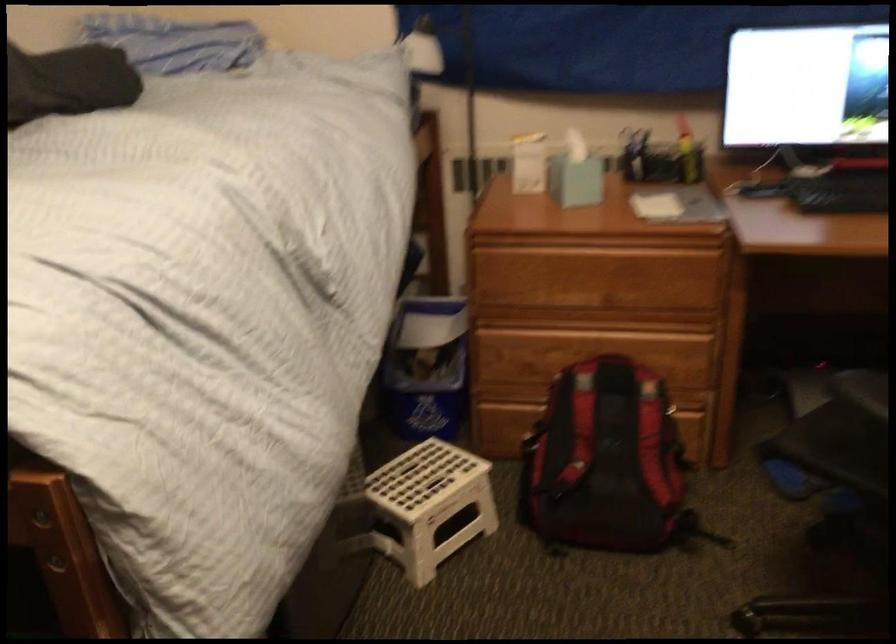
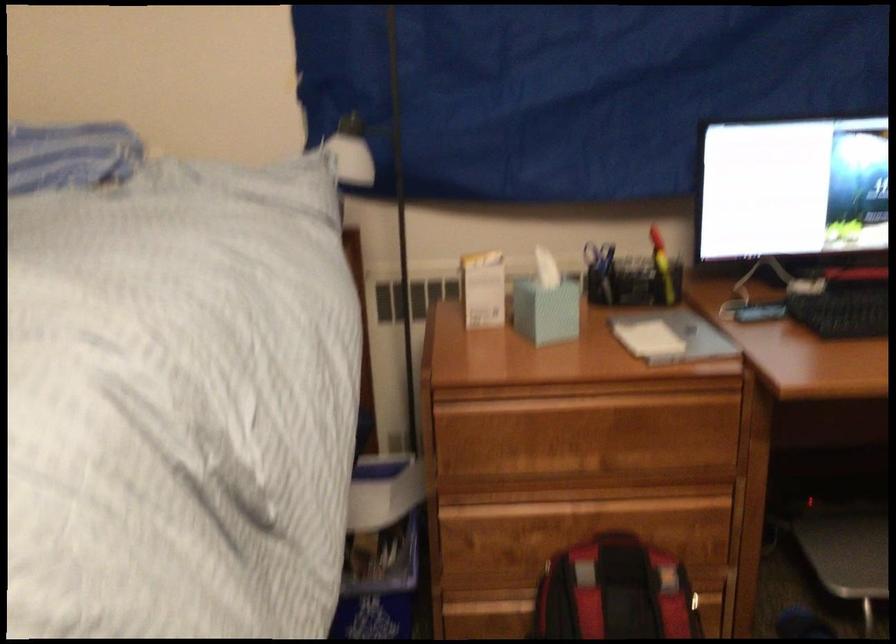
Locate, in the second image, the point that corresponds to (x=610, y=402) in the first image.

(615, 592)